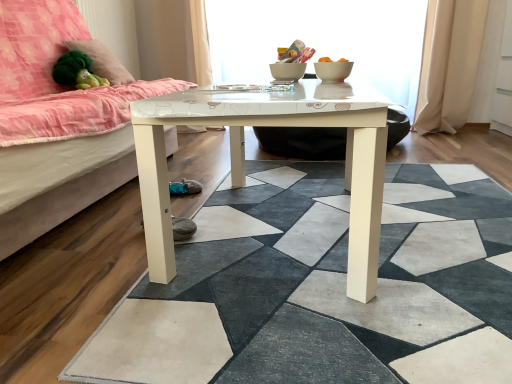
This screenshot has width=512, height=384. What do you see at coordinates (333, 70) in the screenshot? I see `white glossy bowl at upper center` at bounding box center [333, 70].

This screenshot has width=512, height=384. What do you see at coordinates (287, 71) in the screenshot?
I see `white glossy bowl at center` at bounding box center [287, 71].

Describe the element at coordinates (103, 61) in the screenshot. The image size is (512, 384). I see `green plush at upper left` at that location.

This screenshot has height=384, width=512. Find the location of `green plush toy at upper left`. green plush toy at upper left is located at coordinates (76, 71).

At what (x,y) coordinates should I click in order to perform the action: click on white glossy table at center. Please return your answer as a coordinate pair (x, y). This screenshot has height=384, width=512. Looking at the image, I should click on (323, 287).

The image size is (512, 384). I want to click on white glossy table at center, so click(322, 40).

I want to click on white glossy bowl at upper center, so click(x=333, y=70).

Is matte pink fabric at left taller or shorter than beige fabric curtain at right?

matte pink fabric at left is shorter than beige fabric curtain at right.

Considering the sizes of matte pink fabric at left and beige fabric curtain at right in the image, is matte pink fabric at left wider or thinner than beige fabric curtain at right?

Considering their sizes, matte pink fabric at left looks broader than beige fabric curtain at right.

Could you tell me if matte pink fabric at left is facing beige fabric curtain at right?

No, matte pink fabric at left does not turn towards beige fabric curtain at right.

From a real-world perspective, is matte pink fabric at left positioned over beige fabric curtain at right based on gravity?

No, from a real-world perspective, matte pink fabric at left is not on top of beige fabric curtain at right.

Is white glossy bowl at upper center inside or outside of white glossy bowl at center?

white glossy bowl at upper center is not enclosed by white glossy bowl at center.

Where is `bowl on the left of white glossy bowl at upper center`? bowl on the left of white glossy bowl at upper center is located at coordinates (287, 71).

Is point (319, 70) positioned behind point (285, 74)?

No, (319, 70) is in front of (285, 74).

Considering the sizes of objects white glossy bowl at upper center and white glossy bowl at center in the image provided, who is smaller, white glossy bowl at upper center or white glossy bowl at center?

white glossy bowl at center.

From a real-world perspective, between green plush at upper left and beige fabric curtain at right, who is vertically higher?

In real-world perspective, green plush at upper left is above.

Which is closer, (x=94, y=63) or (x=435, y=54)?

The point (x=94, y=63) is closer.

Can you confirm if green plush at upper left is shorter than beige fabric curtain at right?

Indeed, green plush at upper left has a lesser height compared to beige fabric curtain at right.

Is green plush at upper left spatially inside matte pink fabric at left, or outside of it?

green plush at upper left lies within the bounds of matte pink fabric at left.

From the picture: Which is more distant, (x=100, y=44) or (x=34, y=151)?

Point (x=100, y=44)

Considering the positions of objects green plush at upper left and matte pink fabric at left in the image provided, who is in front, green plush at upper left or matte pink fabric at left?

matte pink fabric at left is more forward.

Based on the photo, considering the positions of objects green plush at upper left and matte pink fabric at left in the image provided, who is more to the right, green plush at upper left or matte pink fabric at left?

green plush at upper left.

Is green plush at upper left far away from white glossy table at center?

Indeed, green plush at upper left is not near white glossy table at center.

Does green plush at upper left have a greater width compared to white glossy table at center?

No, green plush at upper left is not wider than white glossy table at center.

Consider the image. From a real-world perspective, who is located lower, green plush at upper left or white glossy table at center?

In real-world perspective, white glossy table at center is lower.

Considering the relative positions of green plush at upper left and white glossy table at center in the image provided, is green plush at upper left to the left of white glossy table at center from the viewer's perspective?

Yes, green plush at upper left is to the left of white glossy table at center.

Which is in front, white glossy bowl at center or matte pink fabric at left?

matte pink fabric at left.

Is white glossy bowl at center oriented away from matte pink fabric at left?

No, white glossy bowl at center is not facing away from matte pink fabric at left.

Could matte pink fabric at left be considered to be inside white glossy bowl at center?

No, white glossy bowl at center does not contain matte pink fabric at left.

Does point (276, 65) come behind point (68, 217)?

Yes, point (276, 65) is behind point (68, 217).

Are white glossy table at center and beige fabric curtain at right far apart?

white glossy table at center is actually quite close to beige fabric curtain at right.

Could you tell me if white glossy table at center is facing beige fabric curtain at right?

No, white glossy table at center is not aimed at beige fabric curtain at right.

From the image's perspective, which is above, white glossy table at center or beige fabric curtain at right?

beige fabric curtain at right.

How different are the orientations of white glossy table at center and beige fabric curtain at right in degrees?

The angular difference between white glossy table at center and beige fabric curtain at right is 89.5 degrees.

Where is `curtain that appears above the matte pink fabric at left (from the image's perspective)`? The width and height of the screenshot is (512, 384). curtain that appears above the matte pink fabric at left (from the image's perspective) is located at coordinates (450, 64).

Image resolution: width=512 pixels, height=384 pixels. I want to click on glass bowl below the white glossy bowl at center (from the image's perspective), so click(333, 70).

Based on their spatial positions, is beige fabric curtain at right or green plush toy at upper left closer to matte pink fabric at left?

Based on the image, green plush toy at upper left appears to be nearer to matte pink fabric at left.

Estimate the real-world distances between objects in this image. Which object is further from green plush toy at upper left, white glossy table at center or green plush at upper left?

white glossy table at center.

Based on their spatial positions, is green plush toy at upper left or beige fabric curtain at right further from white glossy table at center?

beige fabric curtain at right lies further to white glossy table at center than the other object.

Which object lies nearer to the anchor point white glossy bowl at upper center, green plush at upper left or white glossy table at center?

white glossy table at center is closer to white glossy bowl at upper center.

When comparing their distances from green plush toy at upper left, does white glossy table at center or white glossy table at center seem further?

Among the two, white glossy table at center is located further to green plush toy at upper left.

Considering their positions, is white glossy bowl at upper center positioned closer to white glossy table at center than white glossy table at center?

Based on the image, white glossy bowl at upper center appears to be nearer to white glossy table at center.

Based on their spatial positions, is green plush toy at upper left or white glossy table at center closer to white glossy table at center?

white glossy table at center lies closer to white glossy table at center than the other object.

In the scene shown: Estimate the real-world distances between objects in this image. Which object is closer to white glossy table at center, white glossy table at center or green plush at upper left?

Based on the image, green plush at upper left appears to be nearer to white glossy table at center.

Locate an element on the screen. The image size is (512, 384). bowl between white glossy table at center and green plush toy at upper left along the z-axis is located at coordinates (287, 71).

What are the coordinates of `glass bowl between white glossy table at center and white glossy bowl at center from front to back` in the screenshot? It's located at (333, 70).

Where is `glass bowl between matte pink fabric at left and white glossy table at center from left to right`? The width and height of the screenshot is (512, 384). glass bowl between matte pink fabric at left and white glossy table at center from left to right is located at coordinates (333, 70).

The image size is (512, 384). I want to click on glass bowl between green plush toy at upper left and white glossy table at center in the horizontal direction, so click(x=333, y=70).